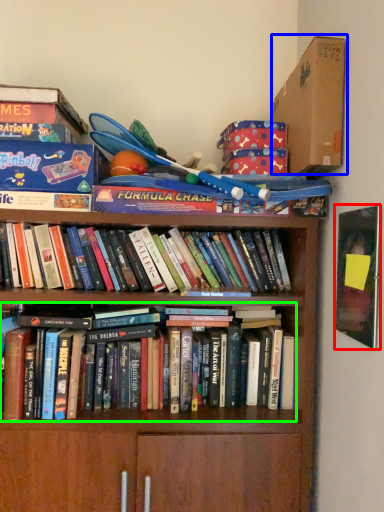
Question: Which object is positioned closest to paperback book (highlighted by a red box)? Select from cardboard box (highlighted by a blue box) and book (highlighted by a green box).

Choices:
 (A) cardboard box
 (B) book

Answer: (A)